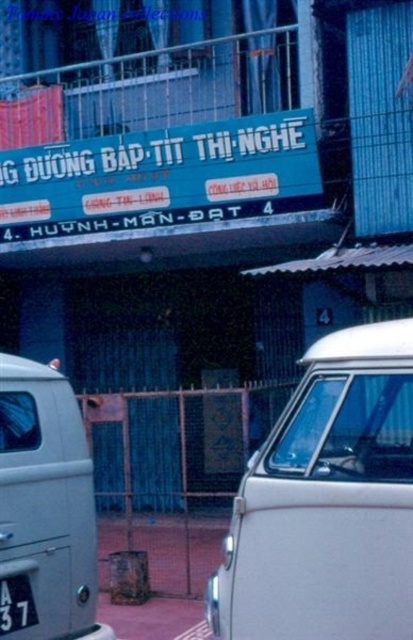
Question: In this image, where is white matte van at center located relative to black metal license plate at lower left?

Choices:
 (A) left
 (B) right

Answer: (B)

Question: Does silver metallic van at left come behind black metal license plate at lower left?

Choices:
 (A) yes
 (B) no

Answer: (B)

Question: Which object is positioned closest to the silver metallic van at left?

Choices:
 (A) black metal license plate at lower left
 (B) white matte van at center

Answer: (A)

Question: Which of the following is the closest to the observer?

Choices:
 (A) click(249, 515)
 (B) click(52, 586)
 (C) click(12, 586)

Answer: (A)

Question: Which object is positioned farthest from the black metal license plate at lower left?

Choices:
 (A) silver metallic van at left
 (B) white matte van at center

Answer: (B)

Question: Is white matte van at center smaller than silver metallic van at left?

Choices:
 (A) yes
 (B) no

Answer: (B)